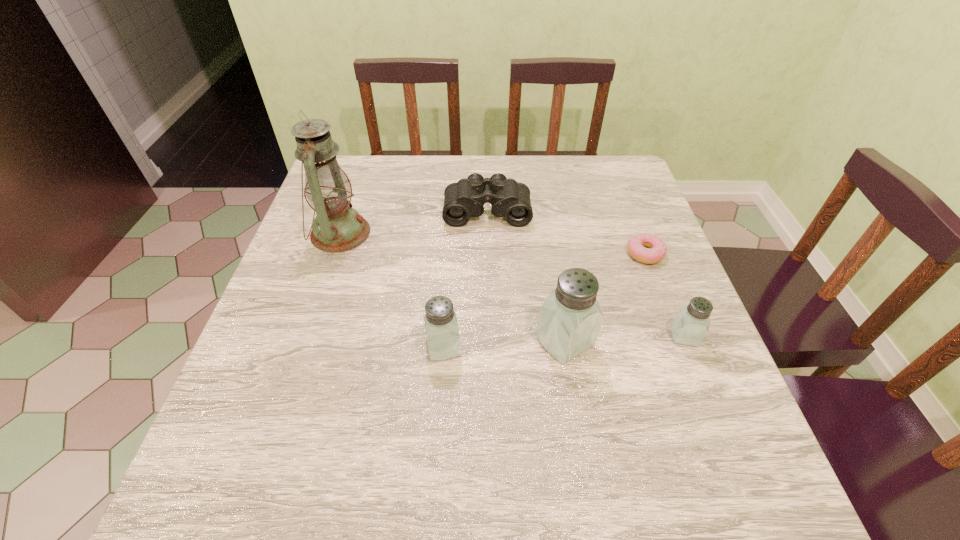
Locate an element on the screen. The image size is (960, 540). vacant region located 0.120m on the back of the second saltshaker from right to left is located at coordinates (555, 278).

At what (x,y) coordinates should I click in order to perform the action: click on blank area located on the back of the shortest saltshaker. Please return your answer as a coordinate pair (x, y). Looking at the image, I should click on pos(652,253).

Identify the location of free spot located at the eyepieces of the binoculars. This screenshot has height=540, width=960. click(490, 322).

Locate an element on the screen. free location located 0.240m on the right of the oil lamp is located at coordinates (465, 233).

Identify the location of vacant space located on the front of the shortest object. This screenshot has width=960, height=540. (674, 329).

This screenshot has height=540, width=960. Find the location of `object that is at the far edge`. object that is at the far edge is located at coordinates (463, 199).

I want to click on object positioned at the left edge, so click(338, 227).

Image resolution: width=960 pixels, height=540 pixels. What are the coordinates of `saltshaker located at the right edge` in the screenshot? It's located at (691, 324).

This screenshot has height=540, width=960. In order to click on doughnut located in the right edge section of the desktop in this screenshot , I will do (x=636, y=245).

The image size is (960, 540). Identify the location of vacant space at the far edge. (537, 166).